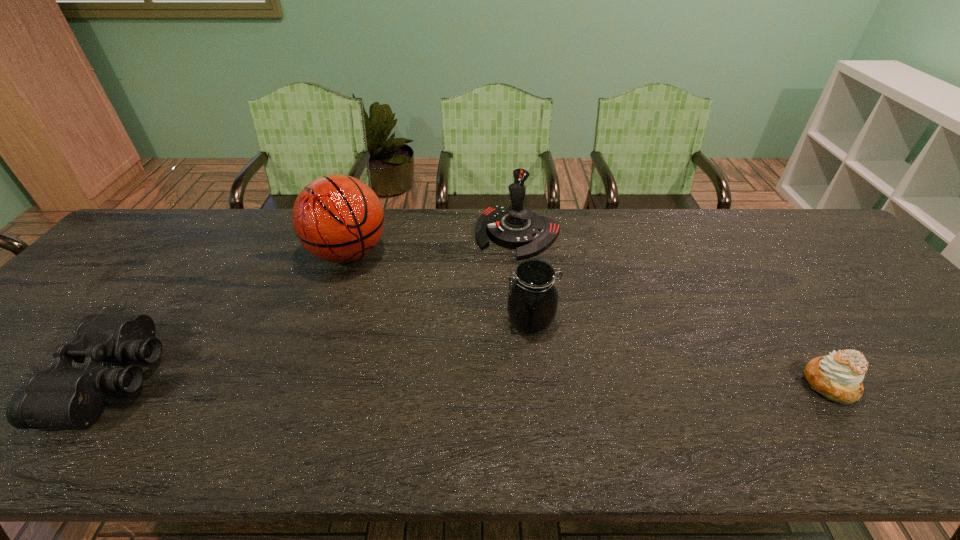
The width and height of the screenshot is (960, 540). In order to click on the leftmost object in this screenshot , I will do `click(62, 396)`.

You are a GUI agent. You are given a task and a screenshot of the screen. Output one action in this format:
    pyautogui.click(x=<x>, y=<y>)
    Task: Click on the pastry
    
    Given the screenshot: What is the action you would take?
    pyautogui.click(x=838, y=376)

In order to click on the third shortest object in this screenshot , I will do `click(532, 303)`.

Where is `the second object from left to right`? the second object from left to right is located at coordinates (337, 218).

Locate an element on the screen. The width and height of the screenshot is (960, 540). the tallest object is located at coordinates (337, 218).

You are a GUI agent. You are given a task and a screenshot of the screen. Output one action in this format:
    pyautogui.click(x=<x>, y=<y>)
    Task: Click on the fourth shortest object
    Image resolution: width=960 pixels, height=540 pixels.
    Given the screenshot: What is the action you would take?
    pyautogui.click(x=516, y=227)

Locate an element on the screen. vacant point located 0.120m at the eyepieces of the leftmost object is located at coordinates (20, 379).

Identify the location of free point located 0.160m at the eyepieces of the leftmost object. The height and width of the screenshot is (540, 960). (2, 379).

What are the coordinates of `free space located at the eyepieces of the leftmost object` in the screenshot? It's located at (52, 379).

The image size is (960, 540). In order to click on vacant point located on the back of the pastry in this screenshot , I will do `click(779, 310)`.